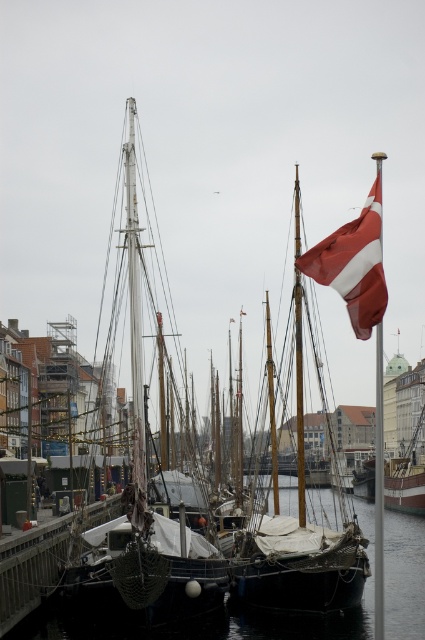
From the picture: You are a photographer planning to take a picture of the transparent water at lower left and the red and white fabric sailboat at center. Since you want both objects in focus, you need to know their distance apart. How far apart are they?

The transparent water at lower left is to the right of the red and white fabric sailboat at center, but the exact distance isn not provided in the scene description.

You are a photographer standing at the pier and want to capture both the white matte sailboat at left and the red and white fabric sailboat at center in your shot. Based on their positions, which sailboat should you focus on first to ensure both are in frame?

The white matte sailboat at left is above the red and white fabric sailboat at center, so you should focus on the white matte sailboat at left first to ensure both are in frame.

You are a photographer standing at the edge of the pier, trying to capture the harbor scene. You notice two points marked in the image. Which point, point 1 at coordinates (139, 637) or point 2 at coordinates (329, 236), is closer to your camera lens?

Point 1 at coordinates (139, 637) is closer to the camera lens than point 2 at coordinates (329, 236).